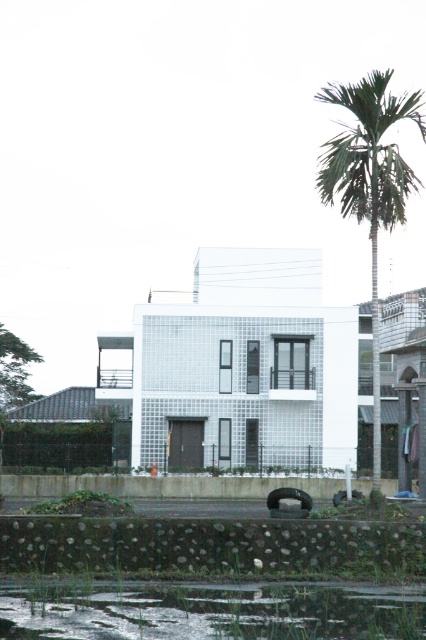
You are standing in front of the residential building and notice the clear water at lower center and the green leafy palm tree at right. Which object is positioned lower in the scene?

The clear water at lower center is positioned below the green leafy palm tree at right, so it is lower in the scene.

You are standing in front of the residential building and notice a point marked at coordinates (212, 611). What is located at this point?

The clear water at lower center is located at point (212, 611).

You are standing in front of the residential building and see the clear water at lower center and the green leafy palm tree at right. Which object is closer to you?

The clear water at lower center is closer to you because it is in front of the green leafy palm tree at right.